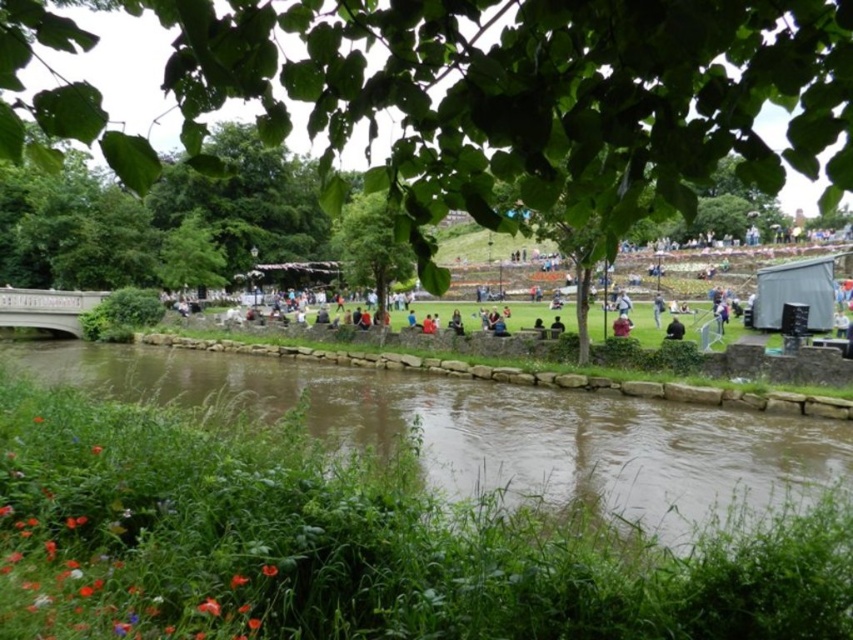
Question: Is green leafy tree at upper center smaller than brown stone river at lower center?

Choices:
 (A) yes
 (B) no

Answer: (B)

Question: Estimate the real-world distances between objects in this image. Which object is closer to the green leafy tree at upper center?

Choices:
 (A) brown stone river at lower center
 (B) green leafy tree at center

Answer: (B)

Question: Does brown stone river at lower center appear under green leafy tree at center?

Choices:
 (A) yes
 (B) no

Answer: (A)

Question: Is brown stone river at lower center closer to the viewer compared to green leafy tree at center?

Choices:
 (A) no
 (B) yes

Answer: (A)

Question: Which object appears farthest from the camera in this image?

Choices:
 (A) green leafy tree at upper center
 (B) green leafy tree at center

Answer: (B)

Question: Which point is closer to the camera?

Choices:
 (A) green leafy tree at upper center
 (B) brown stone river at lower center

Answer: (A)